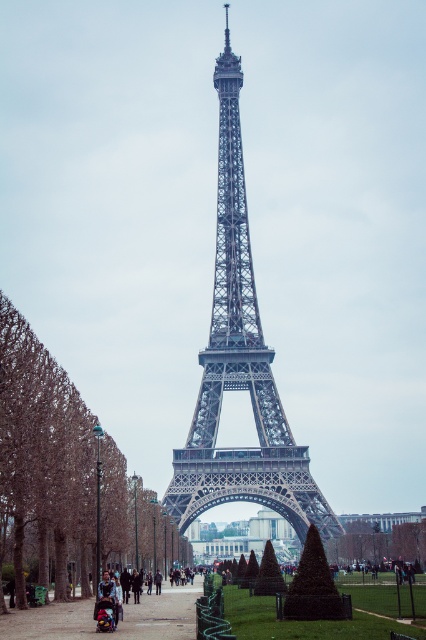
Question: Considering the real-world distances, which object is farthest from the metallic gray eiffel tower at center?

Choices:
 (A) green textured bush at center
 (B) brown leafy tree at left

Answer: (B)

Question: Does brown leafy tree at left appear under green textured bush at center?

Choices:
 (A) yes
 (B) no

Answer: (B)

Question: Does metallic gray eiffel tower at center have a smaller size compared to smooth asphalt path at center?

Choices:
 (A) yes
 (B) no

Answer: (B)

Question: Which of the following is the farthest from the observer?

Choices:
 (A) green textured bush at center
 (B) metallic gray eiffel tower at center
 (C) brown leafy tree at left

Answer: (C)

Question: Is brown leafy tree at left further to the viewer compared to smooth asphalt path at center?

Choices:
 (A) yes
 (B) no

Answer: (B)

Question: Which point appears closest to the camera in this image?

Choices:
 (A) (134, 609)
 (B) (83, 566)
 (C) (388, 554)

Answer: (A)